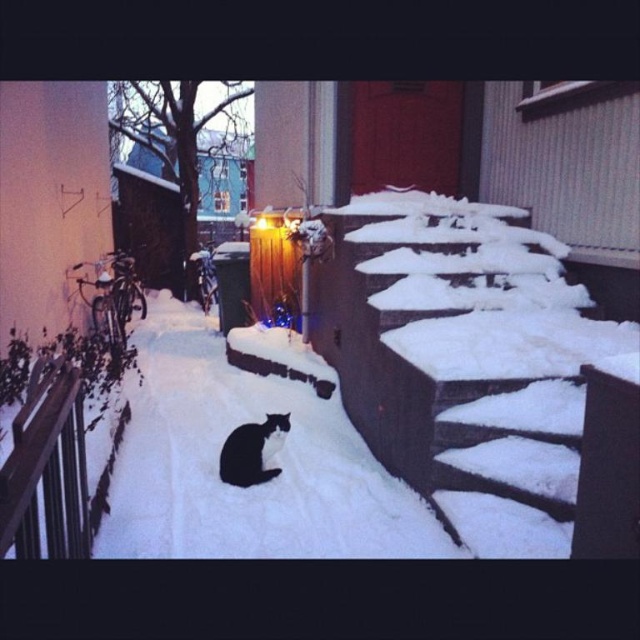
Question: Which of the following is the farthest from the observer?

Choices:
 (A) black fur cat at center
 (B) snow-covered wooden stairs at center

Answer: (A)

Question: Is snow-covered wooden stairs at center positioned behind black fur cat at center?

Choices:
 (A) yes
 (B) no

Answer: (B)

Question: Does snow-covered wooden stairs at center appear over black fur cat at center?

Choices:
 (A) no
 (B) yes

Answer: (B)

Question: Is white fluffy snow at center thinner than black fur cat at center?

Choices:
 (A) yes
 (B) no

Answer: (B)

Question: Considering the real-world distances, which object is closest to the wooden rail at lower left?

Choices:
 (A) black fur cat at center
 (B) snow-covered wooden stairs at center

Answer: (A)

Question: Among these objects, which one is farthest from the camera?

Choices:
 (A) black fur cat at center
 (B) white fluffy snow at center
 (C) wooden rail at lower left

Answer: (A)